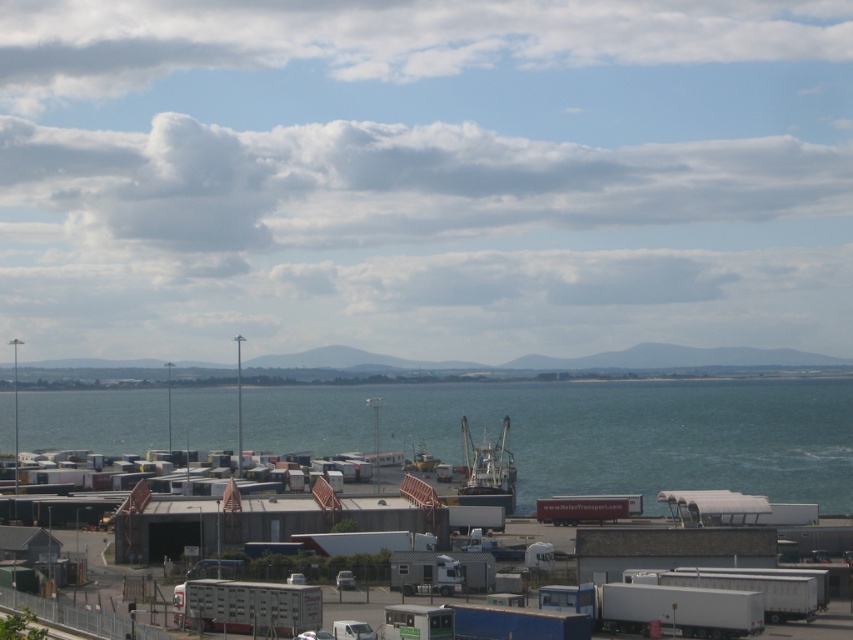
Question: Can you confirm if white metallic trailer truck at lower center is thinner than white matte trailer truck at center?

Choices:
 (A) yes
 (B) no

Answer: (A)

Question: Is metallic gray boat at center smaller than white matte trailer truck at center?

Choices:
 (A) no
 (B) yes

Answer: (A)

Question: Does white metallic trailer truck at lower center lie in front of metallic gray boat at center?

Choices:
 (A) yes
 (B) no

Answer: (A)

Question: Which point is farther to the camera?

Choices:
 (A) blue water at lower center
 (B) white metallic trailer truck at lower center

Answer: (A)

Question: Which is nearer to the white matte trailer truck at center?

Choices:
 (A) metallic gray boat at center
 (B) blue water at lower center

Answer: (A)

Question: Which object is farther from the camera taking this photo?

Choices:
 (A) metallic gray boat at center
 (B) white metallic trailer truck at lower center

Answer: (A)